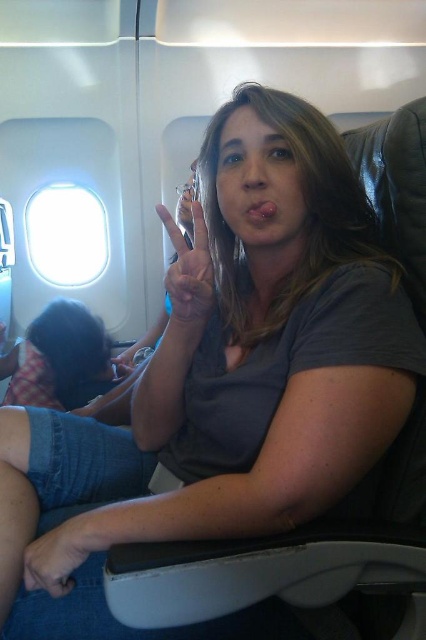
Measure the distance between transparent glass airplane window at upper left and matte silver ring at center.

transparent glass airplane window at upper left and matte silver ring at center are 7.33 feet apart.

Is point (34, 202) farther from viewer compared to point (189, 292)?

That is True.

The height and width of the screenshot is (640, 426). What are the coordinates of `transparent glass airplane window at upper left` in the screenshot? It's located at (66, 234).